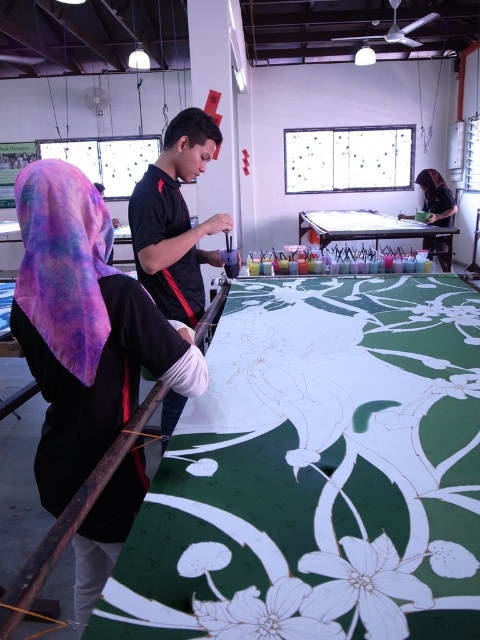
Question: Does black jersey at center lie in front of matte black laptop at upper right?

Choices:
 (A) no
 (B) yes

Answer: (B)

Question: Does black fabric at center have a greater width compared to white paper flower at center?

Choices:
 (A) yes
 (B) no

Answer: (A)

Question: Which object is closer to the camera taking this photo?

Choices:
 (A) matte black laptop at upper right
 (B) black fabric at center
 (C) black jersey at center
 (D) multicolored fabric shawl at left

Answer: (D)

Question: Which object appears farthest from the camera in this image?

Choices:
 (A) black jersey at center
 (B) matte black laptop at upper right
 (C) white paper flower at center
 (D) multicolored fabric shawl at left

Answer: (B)

Question: Which is nearer to the white paper flower at center?

Choices:
 (A) black jersey at center
 (B) black fabric at center
 (C) matte black laptop at upper right
 (D) multicolored fabric shawl at left

Answer: (B)

Question: In this image, where is white paper flower at center located relative to matte black laptop at upper right?

Choices:
 (A) above
 (B) below

Answer: (B)